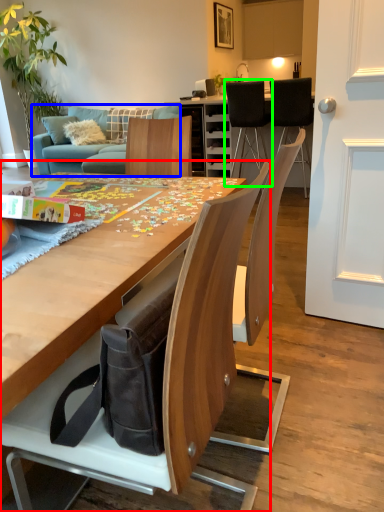
Question: Considering the real-world distances, which object is closest to chair (highlighted by a red box)? studio couch (highlighted by a blue box) or chair (highlighted by a green box).

Choices:
 (A) studio couch
 (B) chair

Answer: (A)